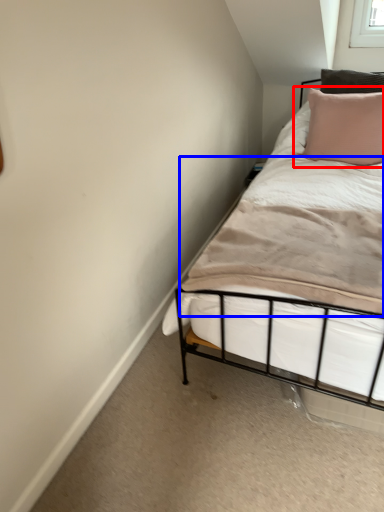
Question: Which object appears closest to the camera in this image, pillow (highlighted by a red box) or mattress (highlighted by a blue box)?

Choices:
 (A) pillow
 (B) mattress

Answer: (B)